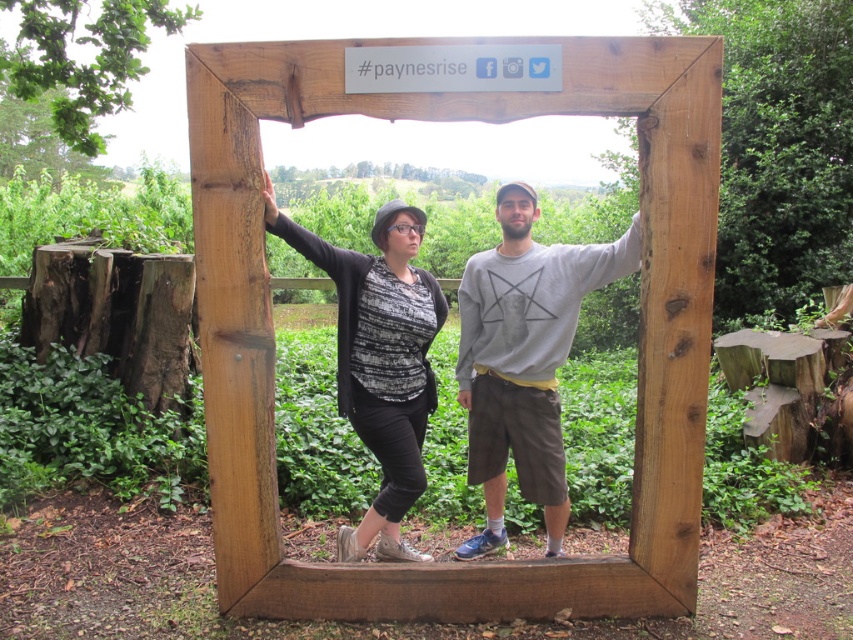
Between white wood sign at upper center and matte gray sweater at center, which one appears on the left side from the viewer's perspective?

Positioned to the left is matte gray sweater at center.

Looking at this image, who is more distant from viewer, (451, 109) or (546, 436)?

The point (546, 436) is behind.

This screenshot has width=853, height=640. Find the location of `white wood sign at upper center`. white wood sign at upper center is located at coordinates (639, 323).

In order to click on white wood sign at upper center in this screenshot , I will do `click(639, 323)`.

Is white wood sign at upper center above matte black cardigan at left?

Yes, white wood sign at upper center is above matte black cardigan at left.

Is point (401, 568) closer to camera compared to point (410, 560)?

Yes.

Describe the element at coordinates (639, 323) in the screenshot. I see `white wood sign at upper center` at that location.

At what (x,y) coordinates should I click in order to perform the action: click on white wood sign at upper center. Please return your answer as a coordinate pair (x, y). This screenshot has height=640, width=853. Looking at the image, I should click on (639, 323).

Between matte gray sweater at center and matte black cardigan at left, which one has more height?

matte gray sweater at center

Does point (526, 492) come farther from viewer compared to point (347, 536)?

No, it is in front of (347, 536).

What do you see at coordinates (524, 358) in the screenshot? I see `matte gray sweater at center` at bounding box center [524, 358].

The width and height of the screenshot is (853, 640). I want to click on matte gray sweater at center, so click(x=524, y=358).